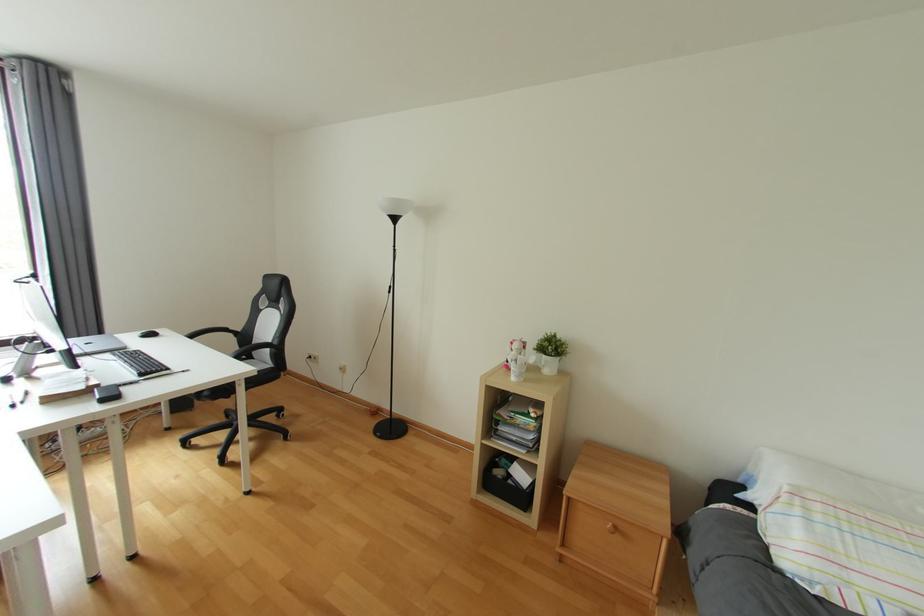
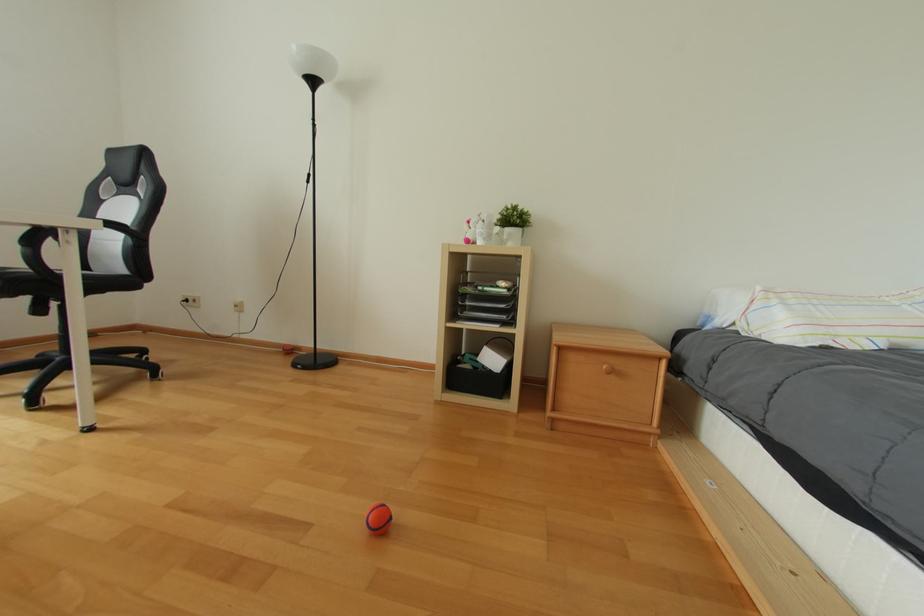
Question: The first image is from the beginning of the video and the second image is from the end. How did the camera likely rotate when shooting the video?

Choices:
 (A) Left
 (B) Right
 (C) Up
 (D) Down

Answer: (B)